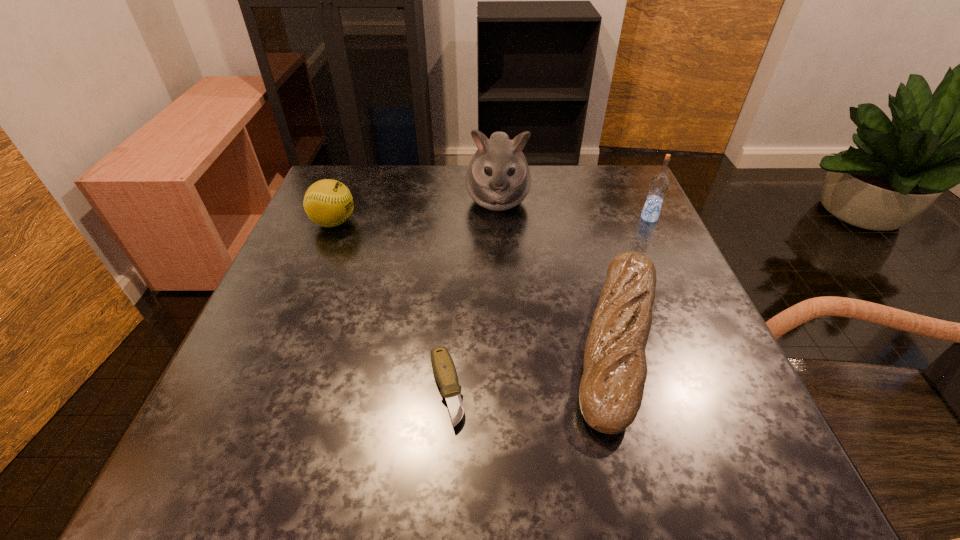
The image size is (960, 540). Identify the location of vacant region that satisfies the following two spatial constraints: 1. on the face of the hamster; 2. on the left side of the second shortest object. (505, 342).

The height and width of the screenshot is (540, 960). I want to click on vacant area that satisfies the following two spatial constraints: 1. on the logo side of the softball; 2. on the right side of the pocketknife, so click(266, 389).

Locate an element on the screen. The height and width of the screenshot is (540, 960). vacant region that satisfies the following two spatial constraints: 1. on the face of the fourth shortest object; 2. on the left side of the hamster is located at coordinates (498, 218).

At what (x,y) coordinates should I click in order to perform the action: click on vacant point that satisfies the following two spatial constraints: 1. on the logo side of the softball; 2. on the back side of the shortest object. Please return your answer as a coordinate pair (x, y). Image resolution: width=960 pixels, height=540 pixels. Looking at the image, I should click on (266, 389).